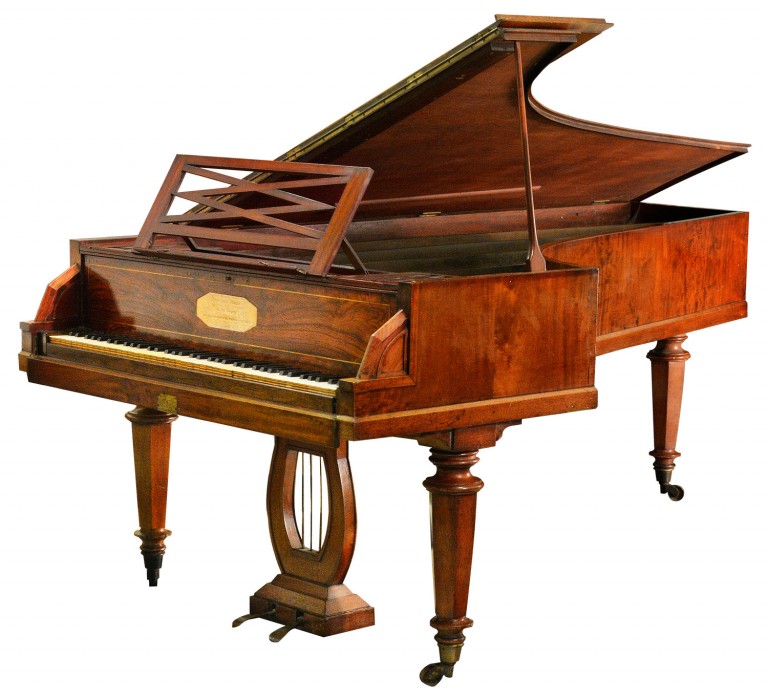
Where is `piano lid`? This screenshot has width=768, height=700. piano lid is located at coordinates (614, 164), (459, 148).